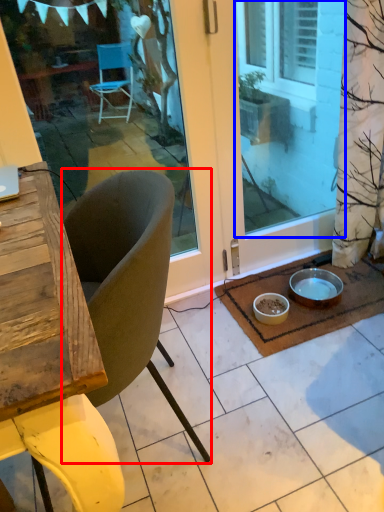
Question: Which object appears farthest to the camera in this image, chair (highlighted by a red box) or window screen (highlighted by a blue box)?

Choices:
 (A) chair
 (B) window screen

Answer: (B)